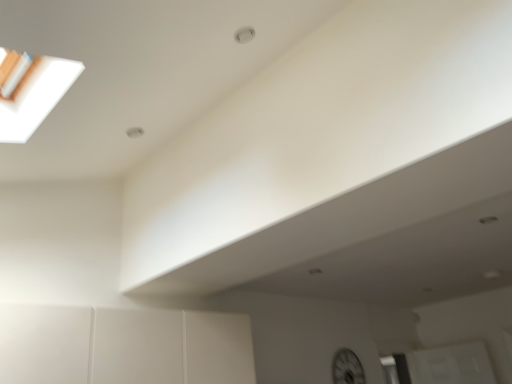
Measure the distance between metallic gray clock at lower center and camera.

A distance of 3.43 meters exists between metallic gray clock at lower center and camera.

Identify the location of metallic gray clock at lower center. (347, 368).

The height and width of the screenshot is (384, 512). Describe the element at coordinates (347, 368) in the screenshot. I see `metallic gray clock at lower center` at that location.

Where is `metallic gray clock at lower center`? This screenshot has width=512, height=384. metallic gray clock at lower center is located at coordinates (347, 368).